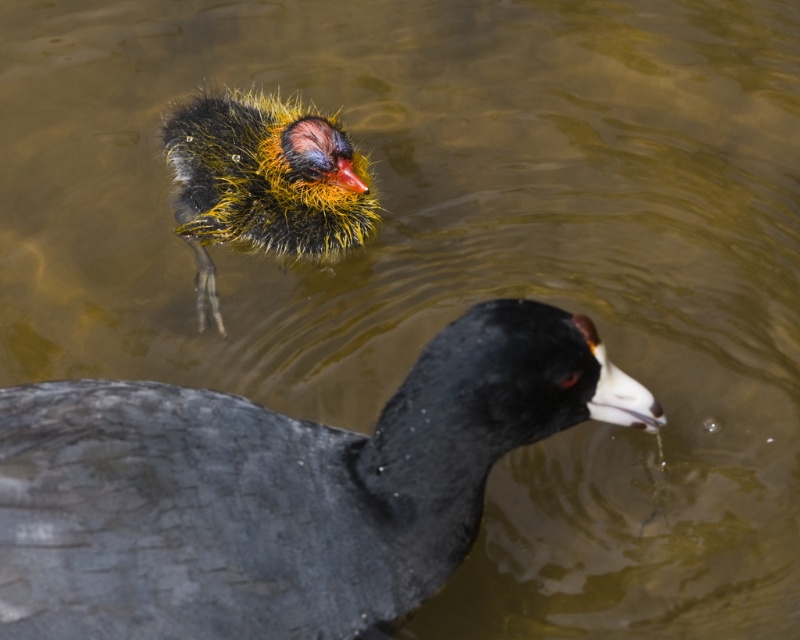
Which of these two, shiny black duck at center or fluffy yellow-black duckling at upper left, stands taller?

fluffy yellow-black duckling at upper left

Between point (148, 496) and point (312, 116), which one is positioned behind?

The point (312, 116) is behind.

Does point (436, 420) come behind point (366, 193)?

No, (436, 420) is closer to viewer.

Where is `shiny black duck at center`? This screenshot has width=800, height=640. shiny black duck at center is located at coordinates coord(277,486).